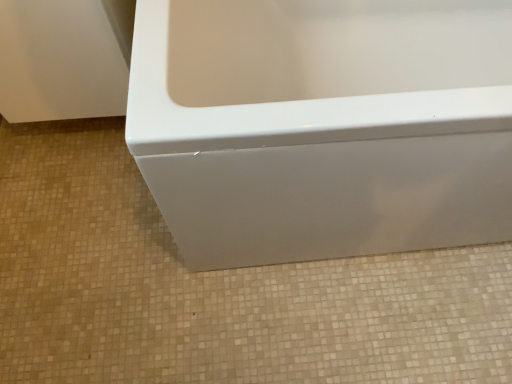
Question: Would you say white glossy bathtub at lower center is outside white glossy bathtub at center?

Choices:
 (A) no
 (B) yes

Answer: (B)

Question: From the image's perspective, does white glossy bathtub at lower center appear lower than white glossy bathtub at center?

Choices:
 (A) yes
 (B) no

Answer: (A)

Question: Does white glossy bathtub at lower center have a smaller size compared to white glossy bathtub at center?

Choices:
 (A) yes
 (B) no

Answer: (A)

Question: Can you confirm if white glossy bathtub at lower center is shorter than white glossy bathtub at center?

Choices:
 (A) yes
 (B) no

Answer: (A)

Question: Are white glossy bathtub at lower center and white glossy bathtub at center beside each other?

Choices:
 (A) no
 (B) yes

Answer: (A)

Question: Does white glossy bathtub at lower center come behind white glossy bathtub at center?

Choices:
 (A) yes
 (B) no

Answer: (A)

Question: Is white glossy bathtub at lower center at the back of white glossy bathtub at center?

Choices:
 (A) yes
 (B) no

Answer: (B)

Question: Is white glossy bathtub at center not close to white glossy bathtub at lower center?

Choices:
 (A) yes
 (B) no

Answer: (B)

Question: Does white glossy bathtub at center lie in front of white glossy bathtub at lower center?

Choices:
 (A) yes
 (B) no

Answer: (A)

Question: Is white glossy bathtub at center positioned behind white glossy bathtub at lower center?

Choices:
 (A) yes
 (B) no

Answer: (B)

Question: Considering the relative sizes of white glossy bathtub at center and white glossy bathtub at lower center in the image provided, is white glossy bathtub at center thinner than white glossy bathtub at lower center?

Choices:
 (A) no
 (B) yes

Answer: (B)

Question: Is white glossy bathtub at center not inside white glossy bathtub at lower center?

Choices:
 (A) yes
 (B) no

Answer: (A)

Question: Choose the correct answer: Is white glossy bathtub at lower center inside white glossy bathtub at center or outside it?

Choices:
 (A) outside
 (B) inside

Answer: (A)